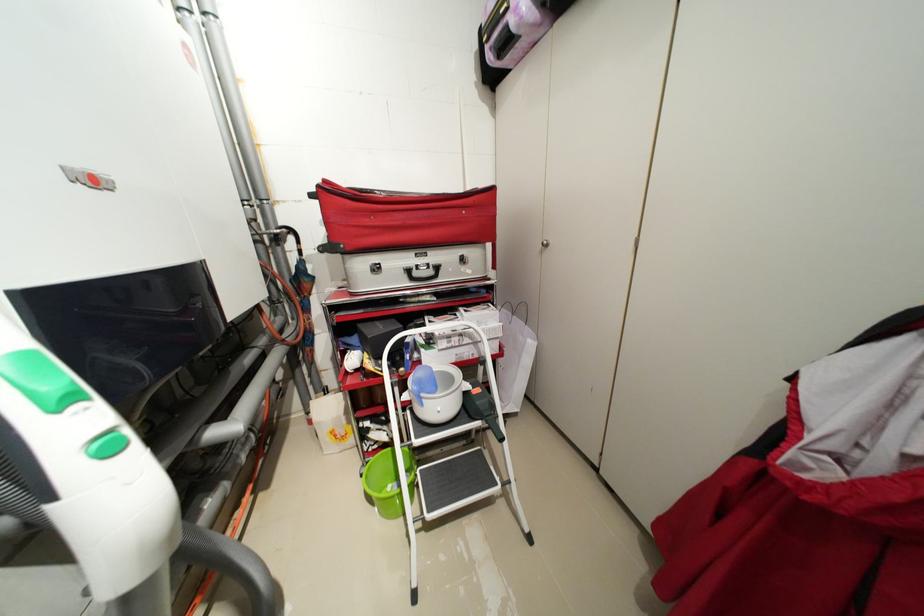
Which object does [423,386] point to?

This point indicates the blue scoop.